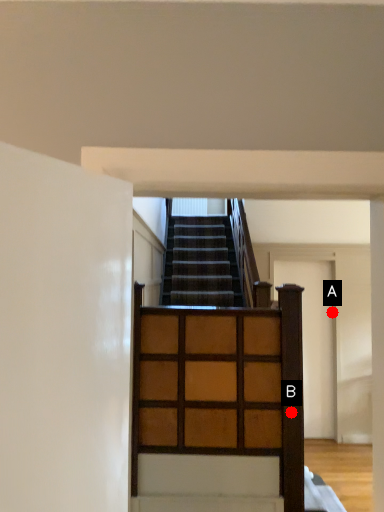
Question: Two points are circled on the image, labeled by A and B beside each circle. Among these points, which one is nearest to the camera?

Choices:
 (A) A is closer
 (B) B is closer

Answer: (B)